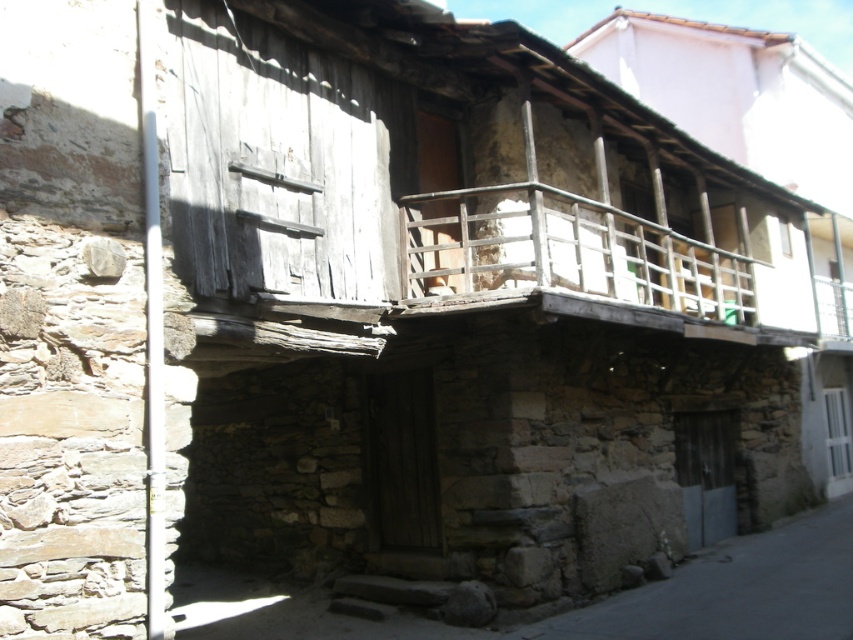
Is weathered wood shutter at left below wooden at upper center?

No, weathered wood shutter at left is not below wooden at upper center.

Between weathered wood shutter at left and wooden at upper center, which one is positioned lower?

Positioned lower is wooden at upper center.

Between point (276, 172) and point (827, 436), which one is positioned in front?

Point (276, 172) is more forward.

Find the location of `weathered wood shutter at left`. weathered wood shutter at left is located at coordinates pos(276,164).

Locate an element on the screen. wooden railing at upper center is located at coordinates (564, 252).

Who is taller, wooden railing at upper center or wooden at upper center?

wooden at upper center is taller.

What do you see at coordinates (564, 252) in the screenshot? I see `wooden railing at upper center` at bounding box center [564, 252].

Where is `wooden railing at upper center`? The width and height of the screenshot is (853, 640). wooden railing at upper center is located at coordinates (564, 252).

Does wooden railing at upper center appear on the right side of gray stone alley at lower right?

Correct, you'll find wooden railing at upper center to the right of gray stone alley at lower right.

Describe the element at coordinates (564, 252) in the screenshot. I see `wooden railing at upper center` at that location.

Locate an element on the screen. wooden railing at upper center is located at coordinates (564, 252).